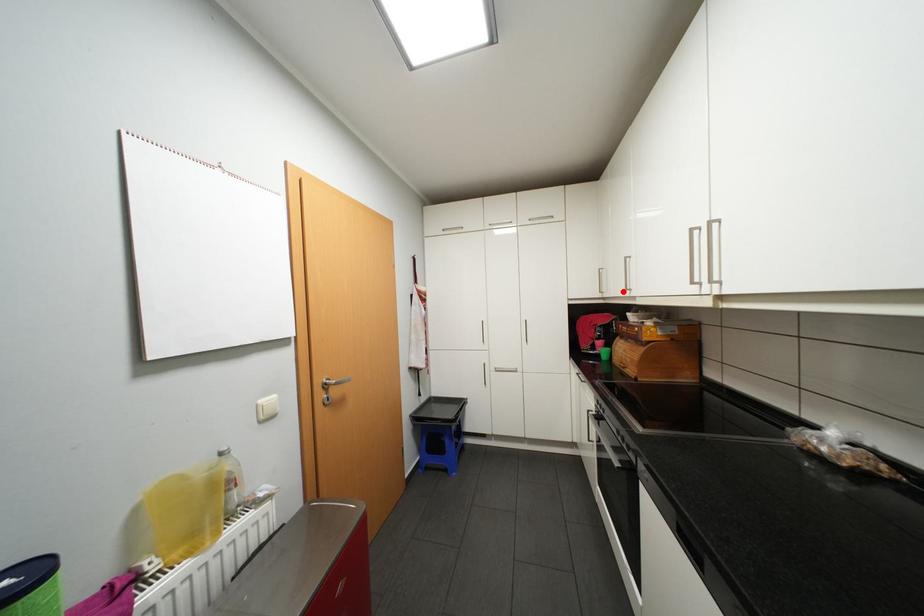
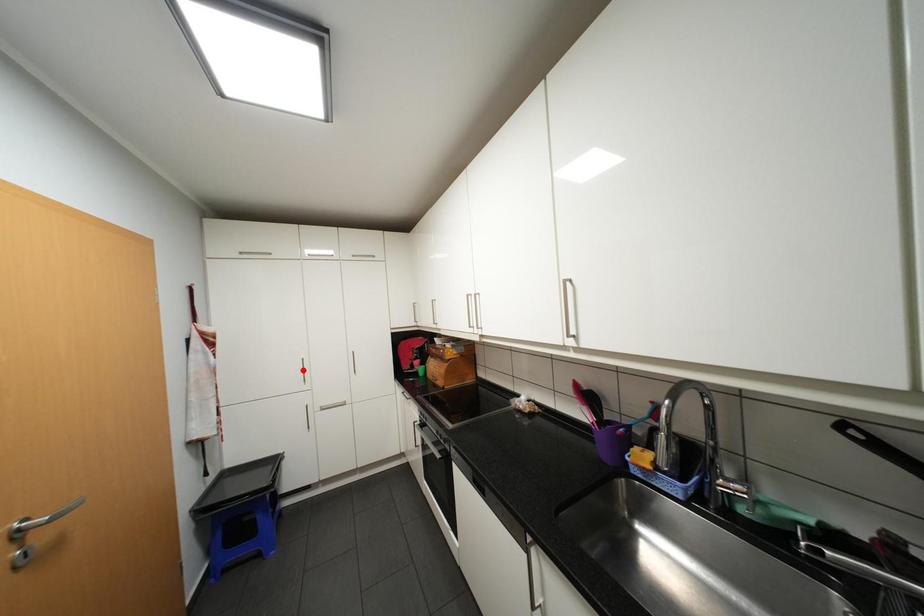
I am providing you with two images of the same scene from different viewpoints. A red point is marked on the first image and another point is marked on the second image. Is the red point in image1 aligned with the point shown in image2?

No